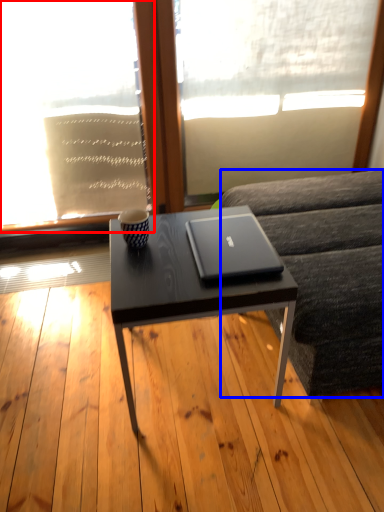
Question: Which object appears farthest to the camera in this image, window screen (highlighted by a red box) or studio couch (highlighted by a blue box)?

Choices:
 (A) window screen
 (B) studio couch

Answer: (A)